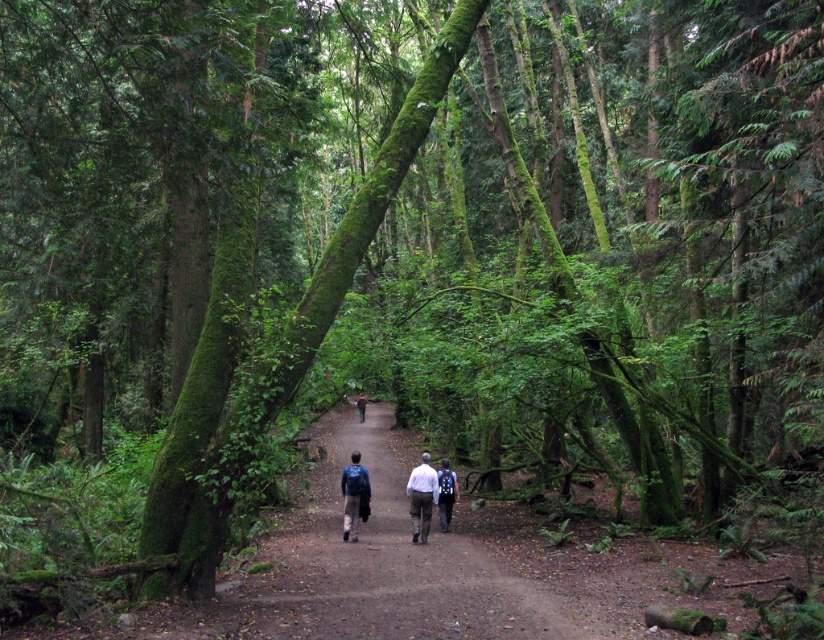
Is point (265, 532) more distant than point (438, 492)?

No, (265, 532) is closer to viewer.

This screenshot has height=640, width=824. What are the coordinates of `dirt path at center` in the screenshot? It's located at (377, 561).

The height and width of the screenshot is (640, 824). I want to click on dirt path at center, so click(x=377, y=561).

Which is behind, point (321, 449) or point (442, 518)?

The point (321, 449) is more distant.

At what (x,y) coordinates should I click in order to perform the action: click on dirt path at center. Please return your answer as a coordinate pair (x, y). The image size is (824, 640). Looking at the image, I should click on (377, 561).

Between light gray fabric backpack at center and matte blue backpack at center, which one appears on the left side from the viewer's perspective?

matte blue backpack at center is more to the left.

Between point (429, 476) and point (349, 484), which one is positioned behind?

The point (429, 476) is behind.

Is point (445, 468) positioned before point (347, 477)?

No, (445, 468) is further to viewer.

You are a GUI agent. You are given a task and a screenshot of the screen. Output one action in this format:
    pyautogui.click(x=<x>, y=<y>)
    Task: Click on the light gray fabric backpack at center
    This screenshot has width=824, height=640.
    Given the screenshot: What is the action you would take?
    pyautogui.click(x=425, y=493)